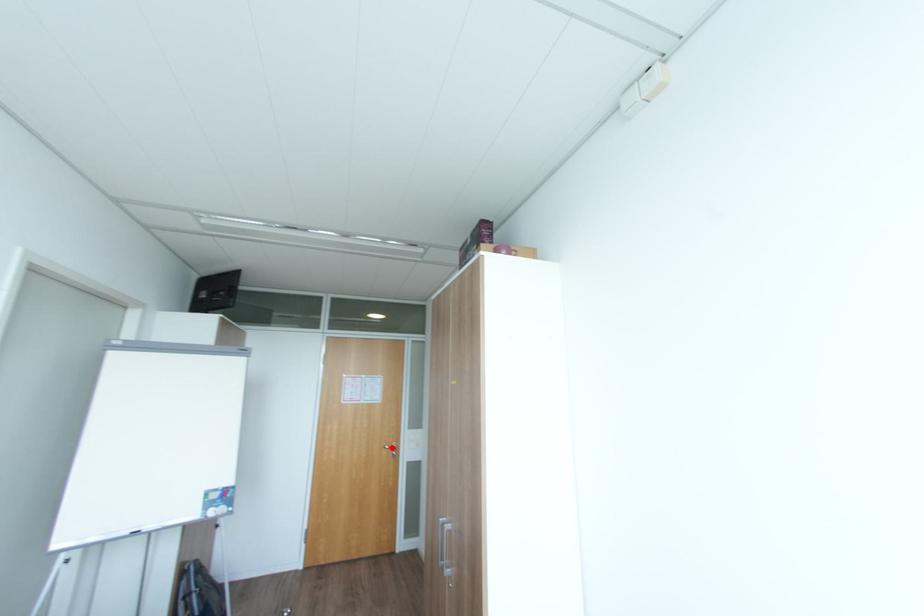
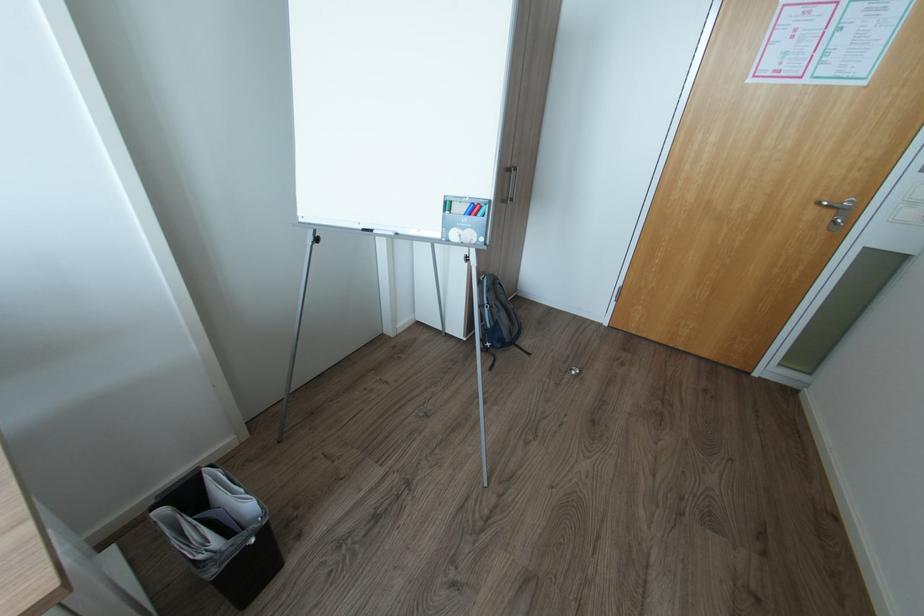
Where in the second image is the point corresponding to the highlighted location from the first image?

(830, 204)